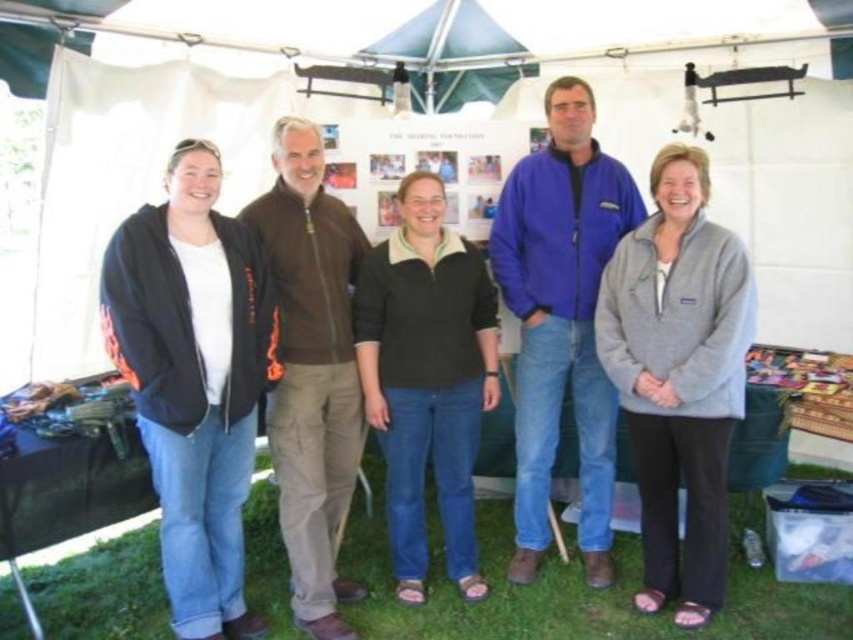
You are organizing a group photo and need to arrange the participants based on their jacket colors. The photographer has instructed you to place the black fleece jacket at left to the immediate right of the gray fleece jacket at center. Is this possible given their current positions?

The black fleece jacket at left is currently to the left of the gray fleece jacket at center, so moving it to the immediate right would require shifting its position, which is possible as long as there is space available.

You are organizing a winter camping trip and need to decide which jacket to wear based on warmth. You have two options from the image available to you. Which jacket, the gray fleece jacket at center or the black fleece at center, would provide better insulation based on their thickness?

The black fleece at center is thicker than the gray fleece jacket at center, so it would provide better insulation for the winter camping trip.

You are planning to place a small potted plant between the black fleece at center and the blue fabric canopy at upper center. Based on their positions, will the plant be under the canopy?

The black fleece at center is positioned under the blue fabric canopy at upper center, so placing the plant between them would mean the plant is also under the canopy.